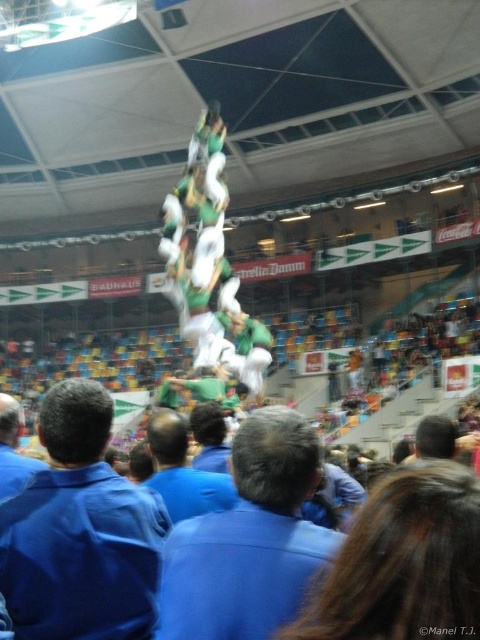
Question: Does green fabric shirt at center appear over blue shirt at lower left?

Choices:
 (A) no
 (B) yes

Answer: (A)

Question: Does green fabric shirt at center have a smaller size compared to green fabric man at center?

Choices:
 (A) no
 (B) yes

Answer: (B)

Question: Which point is closer to the camera?

Choices:
 (A) (253, 472)
 (B) (321, 586)
 (C) (0, 451)

Answer: (B)

Question: Is blue shirt at center further to camera compared to blue shirt at lower left?

Choices:
 (A) yes
 (B) no

Answer: (A)

Question: Which is farther from the green fabric shirt at center?

Choices:
 (A) blue shirt at lower left
 (B) green fabric man at center
 (C) brown hair at center
 (D) blue fabric shirt at center

Answer: (B)

Question: Based on their relative distances, which object is nearer to the blue shirt at lower left?

Choices:
 (A) brown hair at center
 (B) blue fabric shirt at center

Answer: (B)